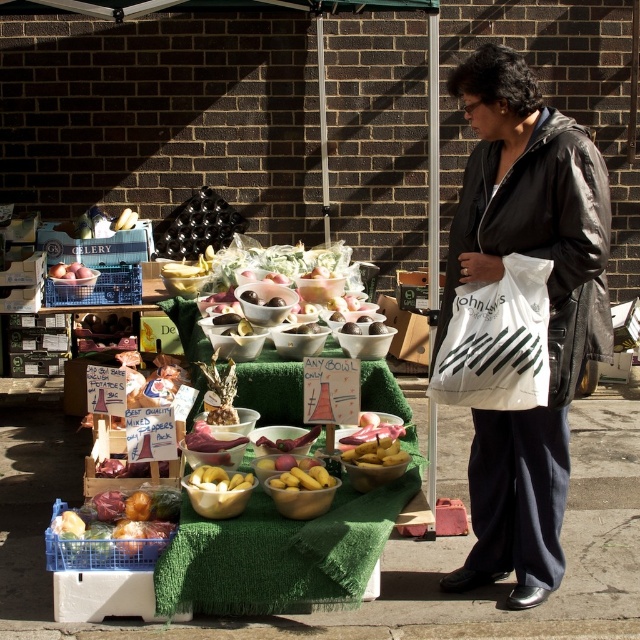
Question: From the image, what is the correct spatial relationship of white plastic bag at center in relation to shiny plastic bag of mixed vegetables at lower left?

Choices:
 (A) below
 (B) above

Answer: (B)

Question: Is shiny black jacket at right bigger than smooth brown apples at left?

Choices:
 (A) yes
 (B) no

Answer: (A)

Question: Which is farther from the shiny black jacket at right?

Choices:
 (A) shiny plastic bag of mixed vegetables at lower left
 (B) white plastic bag at center

Answer: (A)

Question: Is white plastic bag at center in front of smooth brown apples at left?

Choices:
 (A) yes
 (B) no

Answer: (A)

Question: Considering the real-world distances, which object is farthest from the shiny black jacket at right?

Choices:
 (A) smooth brown apples at left
 (B) shiny plastic bag of mixed vegetables at lower left

Answer: (A)

Question: Based on their relative distances, which object is nearer to the shiny black jacket at right?

Choices:
 (A) white plastic bag at center
 (B) shiny plastic bag of mixed vegetables at lower left

Answer: (A)